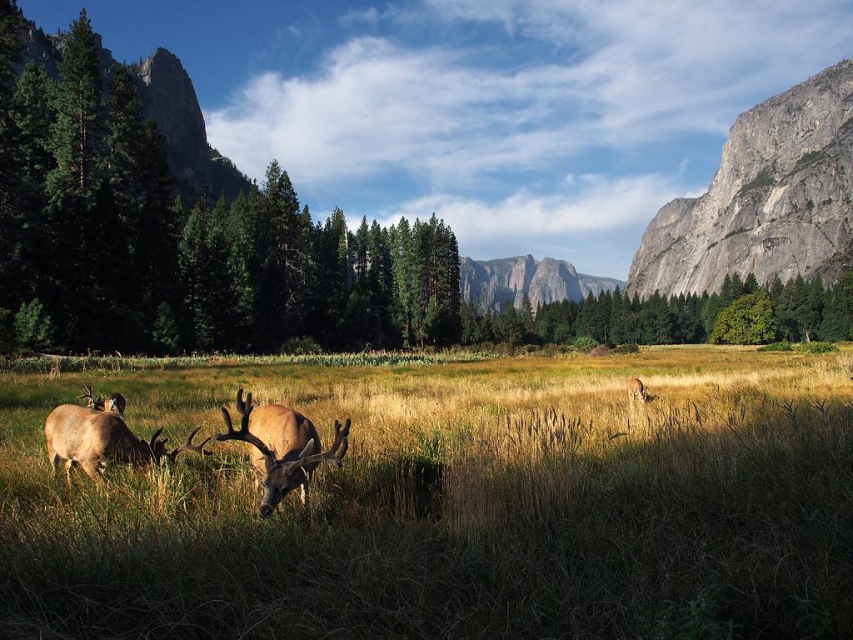
Question: Which object is closer to the camera taking this photo?

Choices:
 (A) smooth granite mountain at center
 (B) brown velvet deer at center-right
 (C) gray rock cliff at right

Answer: (B)

Question: Is green leafy tree at center below smooth granite mountain at center?

Choices:
 (A) no
 (B) yes

Answer: (B)

Question: Can you confirm if green textured pine tree at left is positioned below green leafy tree at center?

Choices:
 (A) yes
 (B) no

Answer: (B)

Question: Which object is positioned closest to the gray rock cliff at right?

Choices:
 (A) golden grass at center
 (B) brown velvet deer at center-right
 (C) smooth granite mountain at center
 (D) brown velvet antlers at left

Answer: (C)

Question: Is golden grass at center further to the viewer compared to green leafy tree at center?

Choices:
 (A) yes
 (B) no

Answer: (B)

Question: Which point appears closest to the camera in this image?

Choices:
 (A) (648, 397)
 (B) (38, 90)
 (C) (544, 301)

Answer: (A)